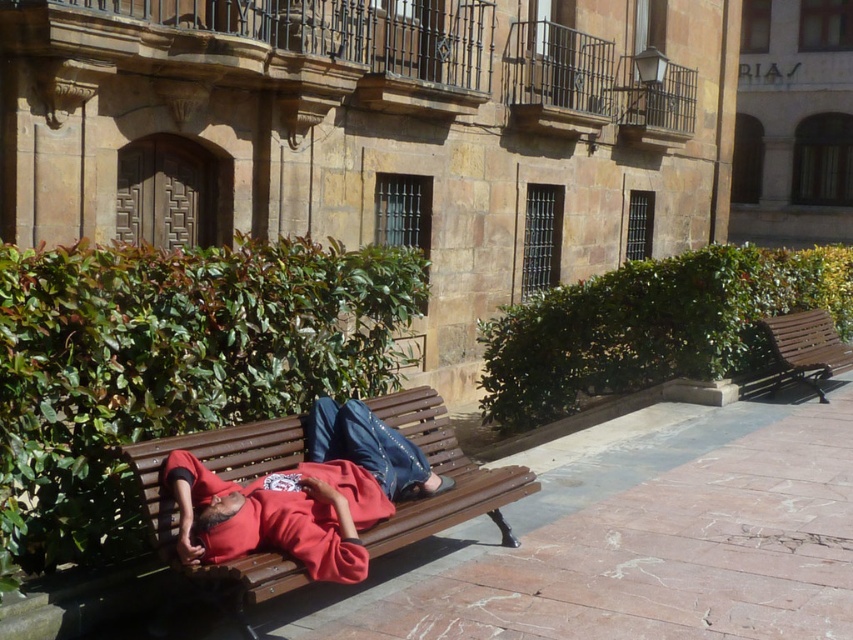
Question: Does brown stone pavement at center have a smaller size compared to wooden bench at right?

Choices:
 (A) yes
 (B) no

Answer: (A)

Question: Is brown stone pavement at center above brown wooden bench at center?

Choices:
 (A) yes
 (B) no

Answer: (B)

Question: Which is farther from the brown wooden bench at center?

Choices:
 (A) brown stone pavement at center
 (B) wooden bench at right

Answer: (B)

Question: Among these points, which one is farthest from the camera?

Choices:
 (A) (540, 596)
 (B) (393, 403)

Answer: (B)

Question: Which of the following is the closest to the observer?

Choices:
 (A) brown stone pavement at center
 (B) brown wooden bench at center
 (C) wooden bench at right

Answer: (B)

Question: Can you confirm if brown stone pavement at center is smaller than wooden bench at right?

Choices:
 (A) yes
 (B) no

Answer: (A)